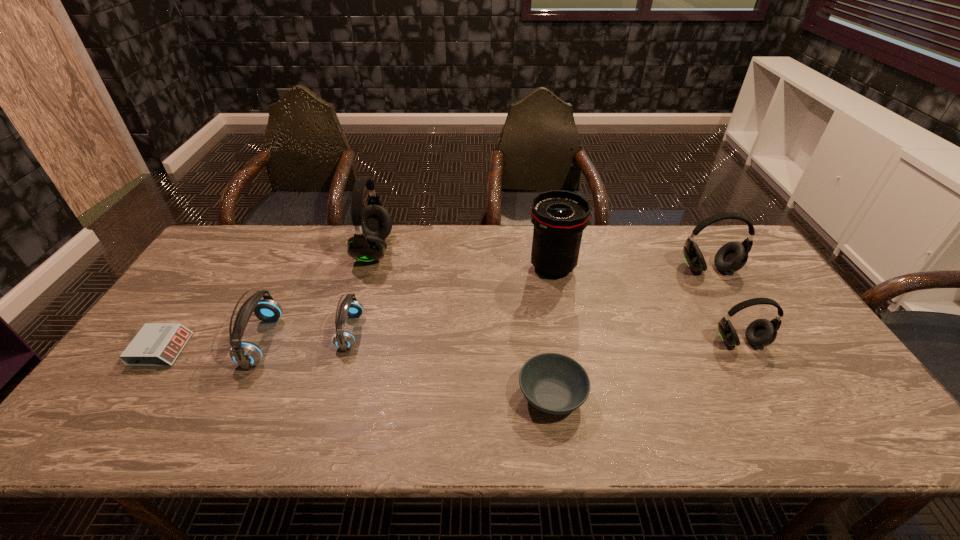
This screenshot has height=540, width=960. I want to click on empty space that is in between the second tallest headset and the shortest headset, so click(530, 300).

Find the location of a particular element. This screenshot has height=540, width=960. unoccupied area between the smaller blue headset and the gray soup bowl is located at coordinates (451, 363).

Find the location of `free point between the second tallest headset and the left blue headset`. free point between the second tallest headset and the left blue headset is located at coordinates (485, 305).

Locate an element on the screen. This screenshot has height=540, width=960. empty space that is in between the soup bowl and the leftmost black headset is located at coordinates (463, 323).

Where is `vacant area that lies between the gray soup bowl and the fourth shortest headset`? This screenshot has width=960, height=540. vacant area that lies between the gray soup bowl and the fourth shortest headset is located at coordinates (630, 333).

In order to click on free space between the smallest black headset and the second object from left to right in this screenshot , I will do `click(501, 342)`.

Identify the location of vacant space that's between the second object from left to right and the telephoto lens. (408, 304).

Where is `unoccupied area between the second object from left to right and the right blue headset`? Image resolution: width=960 pixels, height=540 pixels. unoccupied area between the second object from left to right and the right blue headset is located at coordinates (306, 336).

Choose which object is the second nearest neighbor to the right blue headset. Please provide its 2D coordinates. Your answer should be formatted as a tuple, i.e. [(x, y)], where the tuple contains the x and y coordinates of a point satisfying the conditions above.

[(373, 223)]

At what (x,y) coordinates should I click in order to perform the action: click on object that stands as the third closest to the shortest headset. Please return your answer as a coordinate pair (x, y). The width and height of the screenshot is (960, 540). Looking at the image, I should click on (157, 344).